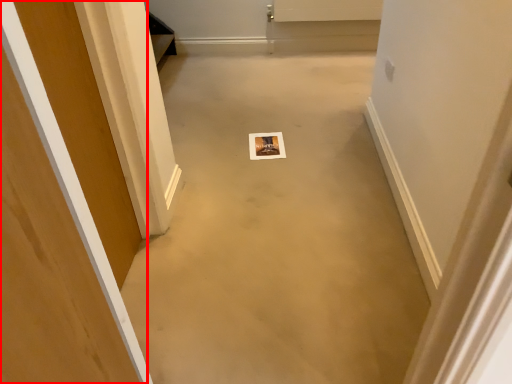
Question: Observing the image, what is the correct spatial positioning of door (annotated by the red box) in reference to concrete?

Choices:
 (A) left
 (B) right

Answer: (A)